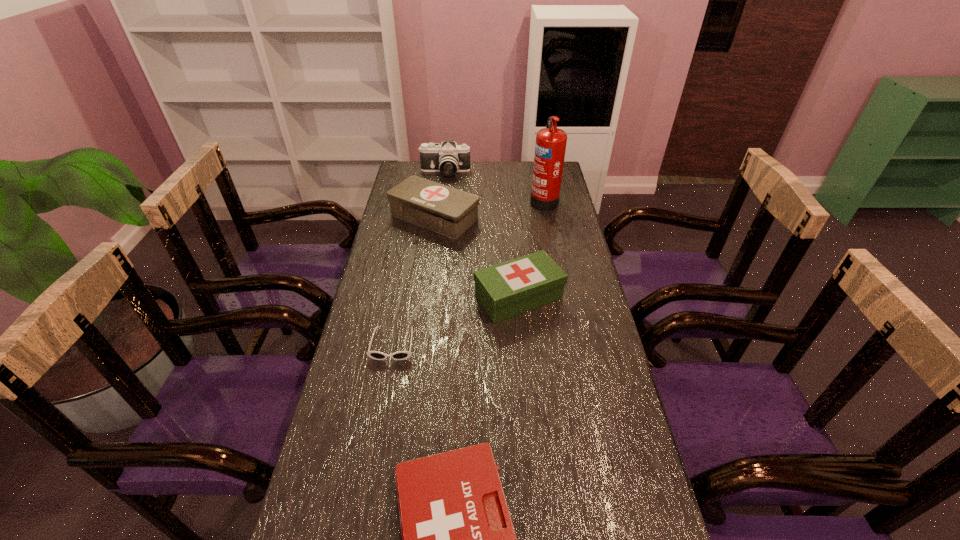
Locate which object is the fourth closest to the farthest first-aid kit. Please provide its 2D coordinates. Your answer should be formatted as a tuple, i.e. [(x, y)], where the tuple contains the x and y coordinates of a point satisfying the conditions above.

[(400, 355)]

Identify the location of the second closest object to the sunglasses. The image size is (960, 540). (458, 539).

Find the location of `the first-aid kit object that ranks as the second closest to the fire extinguisher`. the first-aid kit object that ranks as the second closest to the fire extinguisher is located at coordinates (507, 289).

Find the location of a particular element. the first-aid kit that is the nearest to the shortest object is located at coordinates (x=507, y=289).

Where is `vacant space that satisfies the following two spatial constraints: 1. on the surface of the tallest object; 2. with the lenses of the fifth farthest object facing outward`? This screenshot has width=960, height=540. vacant space that satisfies the following two spatial constraints: 1. on the surface of the tallest object; 2. with the lenses of the fifth farthest object facing outward is located at coordinates point(572,344).

Identify the location of vacant area that satisfies the following two spatial constraints: 1. on the surface of the fire extinguisher; 2. with the lenses of the shortest object facing outward. Image resolution: width=960 pixels, height=540 pixels. click(x=572, y=344).